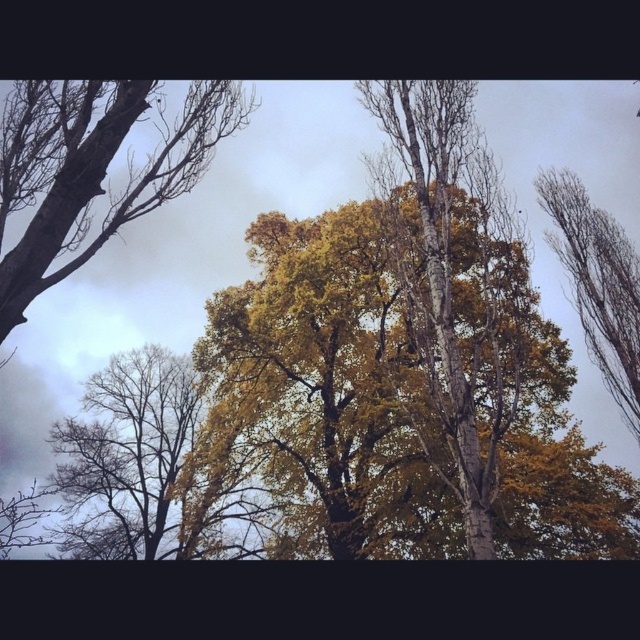
Who is more distant from viewer, (84, 225) or (544, 170)?

Positioned behind is point (544, 170).

Is point (214, 90) positioned before point (580, 260)?

Yes, it is in front of point (580, 260).

Find the location of `smooth bark tree at upper left`. smooth bark tree at upper left is located at coordinates (93, 168).